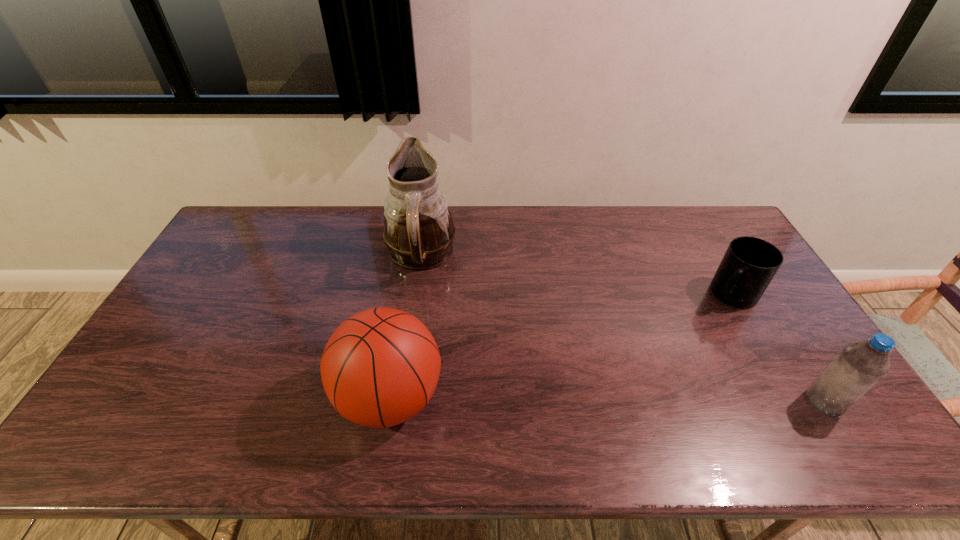
This screenshot has height=540, width=960. Identify the location of free area in between the basketball and the water bottle. (607, 400).

This screenshot has height=540, width=960. I want to click on blank region between the water bottle and the shortest object, so click(x=778, y=348).

You are a GUI agent. You are given a task and a screenshot of the screen. Output one action in this format:
    pyautogui.click(x=<x>, y=<y>)
    Task: Click on the free space between the mug and the basketball
    
    Given the screenshot: What is the action you would take?
    point(561,346)

Where is `object that is the third closest to the basketball`? object that is the third closest to the basketball is located at coordinates (859, 366).

I want to click on object that is the second closest to the tallest object, so click(749, 264).

The height and width of the screenshot is (540, 960). Find the location of `vacant position in the image that satisfies the following two spatial constraints: 1. on the front side of the water bottle; 2. on the left side of the pitcher`. vacant position in the image that satisfies the following two spatial constraints: 1. on the front side of the water bottle; 2. on the left side of the pitcher is located at coordinates (399, 402).

Locate an element on the screen. The image size is (960, 540). vacant space that satisfies the following two spatial constraints: 1. on the back side of the tallest object; 2. on the right side of the basketball is located at coordinates coord(414,257).